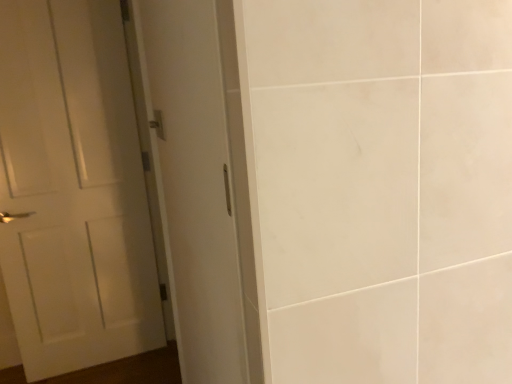
The height and width of the screenshot is (384, 512). I want to click on metallic silver door handle at upper left, so click(x=158, y=124).

You are a GUI agent. You are given a task and a screenshot of the screen. Output one action in this format:
    pyautogui.click(x=<x>, y=<y>)
    Task: Click on the white matte door at left
    The height and width of the screenshot is (384, 512).
    Given the screenshot: What is the action you would take?
    pyautogui.click(x=73, y=189)

Who is smaller, metallic silver door handle at upper left or white glossy door at left?

metallic silver door handle at upper left is smaller.

Considering the relative sizes of metallic silver door handle at upper left and white glossy door at left in the image provided, is metallic silver door handle at upper left thinner than white glossy door at left?

Yes, metallic silver door handle at upper left is thinner than white glossy door at left.

Identify the location of screen door located on the left of metallic silver door handle at upper left. (192, 181).

What's the angular difference between metallic silver door handle at upper left and white glossy door at left's facing directions?

0.506 degrees separate the facing orientations of metallic silver door handle at upper left and white glossy door at left.

Does white glossy door at left touch metallic silver door handle at upper left?

No, white glossy door at left is not touching metallic silver door handle at upper left.

Between white glossy door at left and metallic silver door handle at upper left, which one has more height?

Standing taller between the two is white glossy door at left.

Which of these two, white glossy door at left or metallic silver door handle at upper left, is smaller?

metallic silver door handle at upper left.

Which is correct: white glossy door at left is inside white matte door at left, or outside of it?

white glossy door at left is not inside white matte door at left, it's outside.

From the image's perspective, is white glossy door at left positioned above or below white matte door at left?

white glossy door at left is above white matte door at left.

Based on their sizes in the image, would you say white glossy door at left is bigger or smaller than white matte door at left?

white glossy door at left is bigger than white matte door at left.

From a real-world perspective, which is physically above, white glossy door at left or white matte door at left?

white glossy door at left, from a real-world perspective.

Locate an element on the screen. This screenshot has height=384, width=512. door handle that is above the white matte door at left (from the image's perspective) is located at coordinates (158, 124).

From their relative heights in the image, would you say metallic silver door handle at upper left is taller or shorter than white matte door at left?

In the image, metallic silver door handle at upper left appears to be shorter than white matte door at left.

From a real-world perspective, does metallic silver door handle at upper left stand above white matte door at left?

Yes.

Is metallic silver door handle at upper left positioned before white matte door at left?

That is True.

Would you say white matte door at left is a long distance from metallic silver door handle at upper left?

Yes, white matte door at left and metallic silver door handle at upper left are located far from each other.

In terms of width, does white matte door at left look wider or thinner when compared to metallic silver door handle at upper left?

white matte door at left is wider than metallic silver door handle at upper left.

Is white matte door at left surrounding metallic silver door handle at upper left?

No, white matte door at left does not contain metallic silver door handle at upper left.

Between white matte door at left and white glossy door at left, which one has smaller size?

Smaller between the two is white matte door at left.

From the picture: From a real-world perspective, is white matte door at left on white glossy door at left?

Actually, white matte door at left is physically below white glossy door at left in the real world.

Is white matte door at left not within white glossy door at left?

Yes.

Is white glossy door at left at the back of white matte door at left?

No, white glossy door at left is not at the back of white matte door at left.

I want to click on screen door on the left of metallic silver door handle at upper left, so click(x=192, y=181).

Identify the location of door handle that is above the white glossy door at left (from a real-world perspective). The width and height of the screenshot is (512, 384). (158, 124).

Looking at the image, which one is located closer to metallic silver door handle at upper left, white matte door at left or white glossy door at left?

white glossy door at left.

Estimate the real-world distances between objects in this image. Which object is further from white glossy door at left, white matte door at left or metallic silver door handle at upper left?

Based on the image, white matte door at left appears to be further to white glossy door at left.

Consider the image. Considering their positions, is white glossy door at left positioned further to white matte door at left than metallic silver door handle at upper left?

metallic silver door handle at upper left is positioned further to the anchor white matte door at left.

Estimate the real-world distances between objects in this image. Which object is further from metallic silver door handle at upper left, white glossy door at left or white matte door at left?

The object further to metallic silver door handle at upper left is white matte door at left.

Which object lies nearer to the anchor point white glossy door at left, metallic silver door handle at upper left or white matte door at left?

Based on the image, metallic silver door handle at upper left appears to be nearer to white glossy door at left.

From the image, which object appears to be farther from white matte door at left, metallic silver door handle at upper left or white glossy door at left?

metallic silver door handle at upper left.

At what (x,y) coordinates should I click in order to perform the action: click on screen door located between white matte door at left and metallic silver door handle at upper left in the left-right direction. Please return your answer as a coordinate pair (x, y). The image size is (512, 384). Looking at the image, I should click on (192, 181).